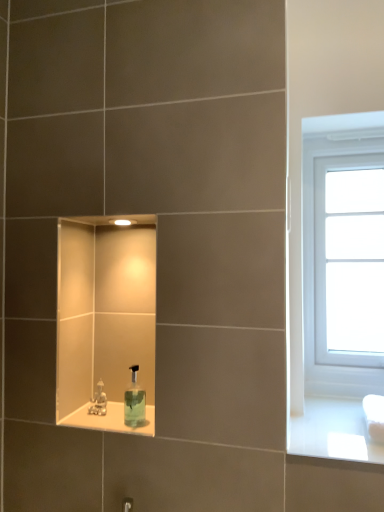
Question: Are white plastic window at right and clear glass soap dispenser at center located far from each other?

Choices:
 (A) yes
 (B) no

Answer: (B)

Question: Is white plastic window at right not within clear glass soap dispenser at center?

Choices:
 (A) yes
 (B) no

Answer: (A)

Question: Can clear glass soap dispenser at center be found inside white plastic window at right?

Choices:
 (A) yes
 (B) no

Answer: (B)

Question: Is white plastic window at right directly adjacent to clear glass soap dispenser at center?

Choices:
 (A) no
 (B) yes

Answer: (A)

Question: Is white plastic window at right facing away from clear glass soap dispenser at center?

Choices:
 (A) yes
 (B) no

Answer: (B)

Question: Does white plastic window at right have a greater height compared to clear glass soap dispenser at center?

Choices:
 (A) yes
 (B) no

Answer: (A)

Question: Is metallic silver faucet at lower center aimed at white plastic window at right?

Choices:
 (A) no
 (B) yes

Answer: (A)

Question: Is white plastic window at right at the back of metallic silver faucet at lower center?

Choices:
 (A) yes
 (B) no

Answer: (B)

Question: Can you confirm if metallic silver faucet at lower center is smaller than white plastic window at right?

Choices:
 (A) yes
 (B) no

Answer: (A)

Question: Is metallic silver faucet at lower center in front of white plastic window at right?

Choices:
 (A) no
 (B) yes

Answer: (B)

Question: Is metallic silver faucet at lower center bigger than white plastic window at right?

Choices:
 (A) yes
 (B) no

Answer: (B)

Question: Considering the relative sizes of metallic silver faucet at lower center and white plastic window at right in the image provided, is metallic silver faucet at lower center thinner than white plastic window at right?

Choices:
 (A) no
 (B) yes

Answer: (B)

Question: Does transparent plastic soap dispenser at center have a greater width compared to white plastic window at right?

Choices:
 (A) yes
 (B) no

Answer: (B)